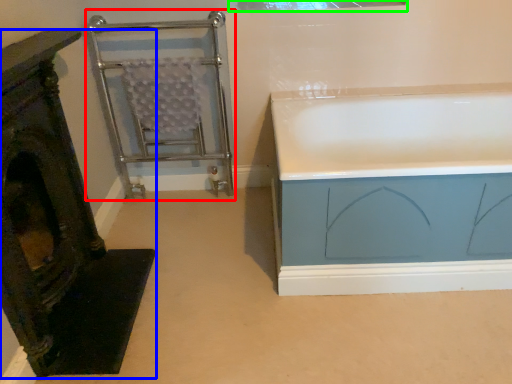
Question: Which object is the closest to the cage (highlighted by a red box)? Choose among these: furniture (highlighted by a blue box) or window (highlighted by a green box).

Choices:
 (A) furniture
 (B) window

Answer: (B)